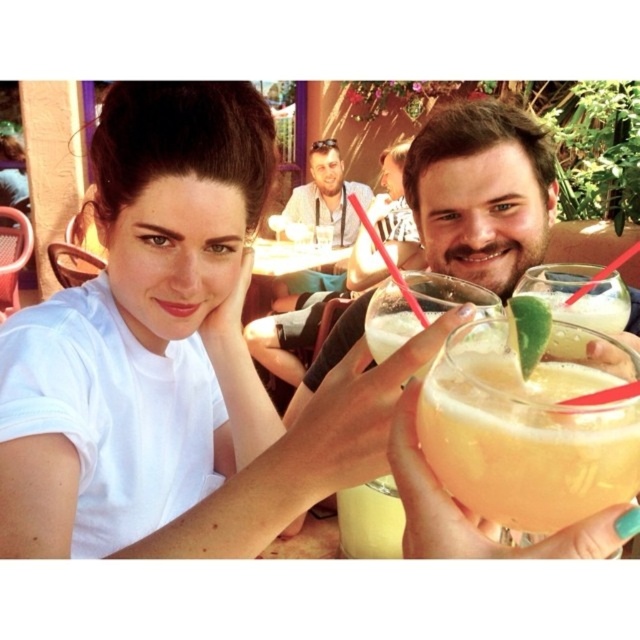
You are a photographer at the event and want to focus on the translucent glass at center and the matte white shirt at center. Which object is closer to the camera?

The translucent glass at center is closer to the camera because it is in front of the matte white shirt at center.

You are a photographer at the event and want to ensure both the matte white shirt at center and the white glossy table at center are in focus. Which object should you prioritize focusing on to ensure depth of field covers both?

The matte white shirt at center might be wider than the white glossy table at center, so focusing on the shirt would ensure the table is within the depth of field.